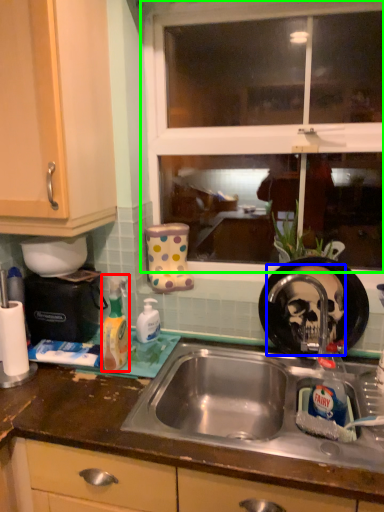
Question: Estimate the real-world distances between objects in this image. Which object is closer to cleaning product (highlighted by a red box), tap (highlighted by a blue box) or window (highlighted by a green box)?

Choices:
 (A) tap
 (B) window

Answer: (A)